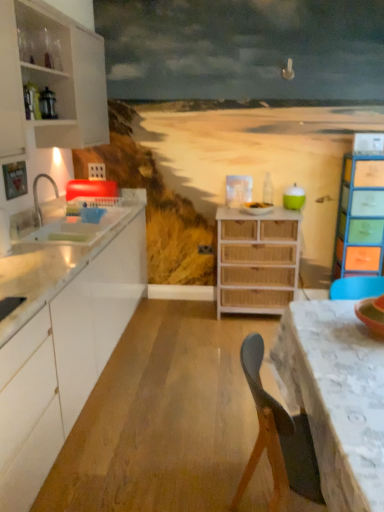
Identify the location of white glossy sink at left. Image resolution: width=384 pixels, height=512 pixels. (57, 231).

What do you see at coordinates (256, 260) in the screenshot?
I see `woven wood chest of drawers at center, which is the first chest of drawers from left to right` at bounding box center [256, 260].

Image resolution: width=384 pixels, height=512 pixels. What are the coordinates of `white lace tablecloth at lower right` in the screenshot? It's located at (336, 397).

From a real-world perspective, does woven wood chest of drawers at center, which ranks as the 2th chest of drawers in right-to-left order, sit lower than multicolored wicker chest of drawers at right, the first chest of drawers from the right?

Indeed, from a real-world perspective, woven wood chest of drawers at center, which ranks as the 2th chest of drawers in right-to-left order, is positioned beneath multicolored wicker chest of drawers at right, the first chest of drawers from the right.

From the image's perspective, which is above, woven wood chest of drawers at center, which ranks as the 2th chest of drawers in right-to-left order, or multicolored wicker chest of drawers at right, which is the 2th chest of drawers from left to right?

multicolored wicker chest of drawers at right, which is the 2th chest of drawers from left to right.

Locate an element on the screen. chest of drawers on the right of the woven wood chest of drawers at center, which ranks as the 2th chest of drawers in right-to-left order is located at coordinates (360, 217).

Can you confirm if woven wood chest of drawers at center, which ranks as the 2th chest of drawers in right-to-left order, is wider than multicolored wicker chest of drawers at right, the first chest of drawers from the right?

Correct, the width of woven wood chest of drawers at center, which ranks as the 2th chest of drawers in right-to-left order, exceeds that of multicolored wicker chest of drawers at right, the first chest of drawers from the right.

From the image's perspective, which object appears higher, woven wood chest of drawers at center, which ranks as the 2th chest of drawers in right-to-left order, or white matte cabinet at left, marked as the first cabinetry in a top-to-bottom arrangement?

white matte cabinet at left, marked as the first cabinetry in a top-to-bottom arrangement, is shown above in the image.

Is woven wood chest of drawers at center, which is the first chest of drawers from left to right, not close to white matte cabinet at left, placed as the second cabinetry when sorted from bottom to top?

Yes.

Considering the relative positions of woven wood chest of drawers at center, which is the first chest of drawers from left to right, and white matte cabinet at left, placed as the second cabinetry when sorted from bottom to top, in the image provided, is woven wood chest of drawers at center, which is the first chest of drawers from left to right, to the left of white matte cabinet at left, placed as the second cabinetry when sorted from bottom to top, from the viewer's perspective?

Incorrect, woven wood chest of drawers at center, which is the first chest of drawers from left to right, is not on the left side of white matte cabinet at left, placed as the second cabinetry when sorted from bottom to top.

Which point is more forward, (51, 416) or (95, 236)?

The point (51, 416) is closer to the camera.

Image resolution: width=384 pixels, height=512 pixels. Identify the location of sink on the right of white glossy cabinet at left, positioned as the 1th cabinetry in bottom-to-top order. (57, 231).

Would you say white glossy sink at left is part of white glossy cabinet at left, which appears as the 2th cabinetry when viewed from the top,'s contents?

Absolutely, white glossy sink at left is inside white glossy cabinet at left, which appears as the 2th cabinetry when viewed from the top.

Considering the sizes of white glossy cabinet at left, positioned as the 1th cabinetry in bottom-to-top order, and white glossy sink at left in the image, is white glossy cabinet at left, positioned as the 1th cabinetry in bottom-to-top order, bigger or smaller than white glossy sink at left?

white glossy cabinet at left, positioned as the 1th cabinetry in bottom-to-top order, is bigger than white glossy sink at left.

Are white matte cabinet at left, placed as the second cabinetry when sorted from bottom to top, and woven wood chest of drawers at center, which is the first chest of drawers from left to right, far apart?

Yes, white matte cabinet at left, placed as the second cabinetry when sorted from bottom to top, is far from woven wood chest of drawers at center, which is the first chest of drawers from left to right.

Which of these two, white matte cabinet at left, marked as the first cabinetry in a top-to-bottom arrangement, or woven wood chest of drawers at center, which is the first chest of drawers from left to right, is bigger?

With larger size is white matte cabinet at left, marked as the first cabinetry in a top-to-bottom arrangement.

Is white matte cabinet at left, marked as the first cabinetry in a top-to-bottom arrangement, facing towards woven wood chest of drawers at center, which ranks as the 2th chest of drawers in right-to-left order?

No, white matte cabinet at left, marked as the first cabinetry in a top-to-bottom arrangement, is not turned towards woven wood chest of drawers at center, which ranks as the 2th chest of drawers in right-to-left order.

Which is in front, point (23, 111) or point (290, 253)?

The point (23, 111) is more forward.

Can you see white glossy sink at left touching white matte cabinet at left, placed as the second cabinetry when sorted from bottom to top?

No, white glossy sink at left is not touching white matte cabinet at left, placed as the second cabinetry when sorted from bottom to top.

From the picture: Which of these two, white glossy sink at left or white matte cabinet at left, placed as the second cabinetry when sorted from bottom to top, is thinner?

With smaller width is white matte cabinet at left, placed as the second cabinetry when sorted from bottom to top.

Between white glossy sink at left and white matte cabinet at left, marked as the first cabinetry in a top-to-bottom arrangement, which one has more height?

With more height is white matte cabinet at left, marked as the first cabinetry in a top-to-bottom arrangement.

From the picture: From a real-world perspective, which object stands above the other?

In real-world perspective, white matte cabinet at left, marked as the first cabinetry in a top-to-bottom arrangement, is above.

Is the depth of white lace tablecloth at lower right greater than that of woven wood chest of drawers at center, which is the first chest of drawers from left to right?

No, the depth of white lace tablecloth at lower right is less than that of woven wood chest of drawers at center, which is the first chest of drawers from left to right.

Considering the positions of objects white lace tablecloth at lower right and woven wood chest of drawers at center, which is the first chest of drawers from left to right, in the image provided, who is more to the right, white lace tablecloth at lower right or woven wood chest of drawers at center, which is the first chest of drawers from left to right,?

white lace tablecloth at lower right is more to the right.

Is white lace tablecloth at lower right situated inside woven wood chest of drawers at center, which ranks as the 2th chest of drawers in right-to-left order, or outside?

white lace tablecloth at lower right is located beyond the bounds of woven wood chest of drawers at center, which ranks as the 2th chest of drawers in right-to-left order.

From a real-world perspective, who is located lower, white lace tablecloth at lower right or woven wood chest of drawers at center, which is the first chest of drawers from left to right?

From a 3D spatial view, white lace tablecloth at lower right is below.

From a real-world perspective, who is located lower, white glossy cabinet at left, positioned as the 1th cabinetry in bottom-to-top order, or white matte cabinet at left, placed as the second cabinetry when sorted from bottom to top?

white glossy cabinet at left, positioned as the 1th cabinetry in bottom-to-top order, is physically lower.

In terms of height, does white glossy cabinet at left, positioned as the 1th cabinetry in bottom-to-top order, look taller or shorter compared to white matte cabinet at left, marked as the first cabinetry in a top-to-bottom arrangement?

In the image, white glossy cabinet at left, positioned as the 1th cabinetry in bottom-to-top order, appears to be taller than white matte cabinet at left, marked as the first cabinetry in a top-to-bottom arrangement.

Does white glossy cabinet at left, which appears as the 2th cabinetry when viewed from the top, appear on the right side of white matte cabinet at left, placed as the second cabinetry when sorted from bottom to top?

Indeed, white glossy cabinet at left, which appears as the 2th cabinetry when viewed from the top, is positioned on the right side of white matte cabinet at left, placed as the second cabinetry when sorted from bottom to top.

Which object is thinner, white glossy cabinet at left, which appears as the 2th cabinetry when viewed from the top, or white matte cabinet at left, placed as the second cabinetry when sorted from bottom to top?

With smaller width is white matte cabinet at left, placed as the second cabinetry when sorted from bottom to top.

Where is `chest of drawers behind the multicolored wicker chest of drawers at right, which is the 2th chest of drawers from left to right`? Image resolution: width=384 pixels, height=512 pixels. chest of drawers behind the multicolored wicker chest of drawers at right, which is the 2th chest of drawers from left to right is located at coordinates pos(256,260).

The width and height of the screenshot is (384, 512). Identify the location of cabinetry that is the 1st one when counting forward from the woven wood chest of drawers at center, which ranks as the 2th chest of drawers in right-to-left order. (51, 78).

When comparing their distances from white glossy sink at left, does multicolored wicker chest of drawers at right, the first chest of drawers from the right, or white glossy cabinet at left, positioned as the 1th cabinetry in bottom-to-top order, seem closer?

white glossy cabinet at left, positioned as the 1th cabinetry in bottom-to-top order, lies closer to white glossy sink at left than the other object.

Based on their spatial positions, is woven wood chest of drawers at center, which is the first chest of drawers from left to right, or white matte cabinet at left, marked as the first cabinetry in a top-to-bottom arrangement, further from multicolored wicker chest of drawers at right, which is the 2th chest of drawers from left to right?

Based on the image, white matte cabinet at left, marked as the first cabinetry in a top-to-bottom arrangement, appears to be further to multicolored wicker chest of drawers at right, which is the 2th chest of drawers from left to right.

Which object lies further to the anchor point woven wood chest of drawers at center, which ranks as the 2th chest of drawers in right-to-left order, white glossy cabinet at left, positioned as the 1th cabinetry in bottom-to-top order, or white matte cabinet at left, placed as the second cabinetry when sorted from bottom to top?

The object further to woven wood chest of drawers at center, which ranks as the 2th chest of drawers in right-to-left order, is white matte cabinet at left, placed as the second cabinetry when sorted from bottom to top.

Looking at the image, which one is located further to white matte cabinet at left, placed as the second cabinetry when sorted from bottom to top, multicolored wicker chest of drawers at right, the first chest of drawers from the right, or white glossy cabinet at left, which appears as the 2th cabinetry when viewed from the top?

The object further to white matte cabinet at left, placed as the second cabinetry when sorted from bottom to top, is multicolored wicker chest of drawers at right, the first chest of drawers from the right.

When comparing their distances from woven wood chest of drawers at center, which is the first chest of drawers from left to right, does white glossy sink at left or white matte cabinet at left, marked as the first cabinetry in a top-to-bottom arrangement, seem closer?

white glossy sink at left is closer to woven wood chest of drawers at center, which is the first chest of drawers from left to right.

From the image, which object appears to be farther from white glossy cabinet at left, positioned as the 1th cabinetry in bottom-to-top order, woven wood chest of drawers at center, which is the first chest of drawers from left to right, or white glossy sink at left?

Based on the image, woven wood chest of drawers at center, which is the first chest of drawers from left to right, appears to be further to white glossy cabinet at left, positioned as the 1th cabinetry in bottom-to-top order.

Looking at this image, estimate the real-world distances between objects in this image. Which object is further from multicolored wicker chest of drawers at right, which is the 2th chest of drawers from left to right, white glossy cabinet at left, which appears as the 2th cabinetry when viewed from the top, or woven wood chest of drawers at center, which ranks as the 2th chest of drawers in right-to-left order?

white glossy cabinet at left, which appears as the 2th cabinetry when viewed from the top.

Based on their spatial positions, is white matte cabinet at left, placed as the second cabinetry when sorted from bottom to top, or white lace tablecloth at lower right closer to woven wood chest of drawers at center, which ranks as the 2th chest of drawers in right-to-left order?

white matte cabinet at left, placed as the second cabinetry when sorted from bottom to top, lies closer to woven wood chest of drawers at center, which ranks as the 2th chest of drawers in right-to-left order, than the other object.

Identify the location of sink situated between white glossy cabinet at left, which appears as the 2th cabinetry when viewed from the top, and multicolored wicker chest of drawers at right, the first chest of drawers from the right, from left to right. This screenshot has width=384, height=512. (57, 231).

This screenshot has height=512, width=384. I want to click on sink located between white matte cabinet at left, marked as the first cabinetry in a top-to-bottom arrangement, and woven wood chest of drawers at center, which ranks as the 2th chest of drawers in right-to-left order, in the left-right direction, so click(57, 231).

The image size is (384, 512). Identify the location of sink between white glossy cabinet at left, which appears as the 2th cabinetry when viewed from the top, and white lace tablecloth at lower right, in the horizontal direction. (57, 231).

Find the location of `table between white matte cabinet at left, marked as the first cabinetry in a top-to-bottom arrangement, and multicolored wicker chest of drawers at right, the first chest of drawers from the right, from left to right`. table between white matte cabinet at left, marked as the first cabinetry in a top-to-bottom arrangement, and multicolored wicker chest of drawers at right, the first chest of drawers from the right, from left to right is located at coordinates (336, 397).